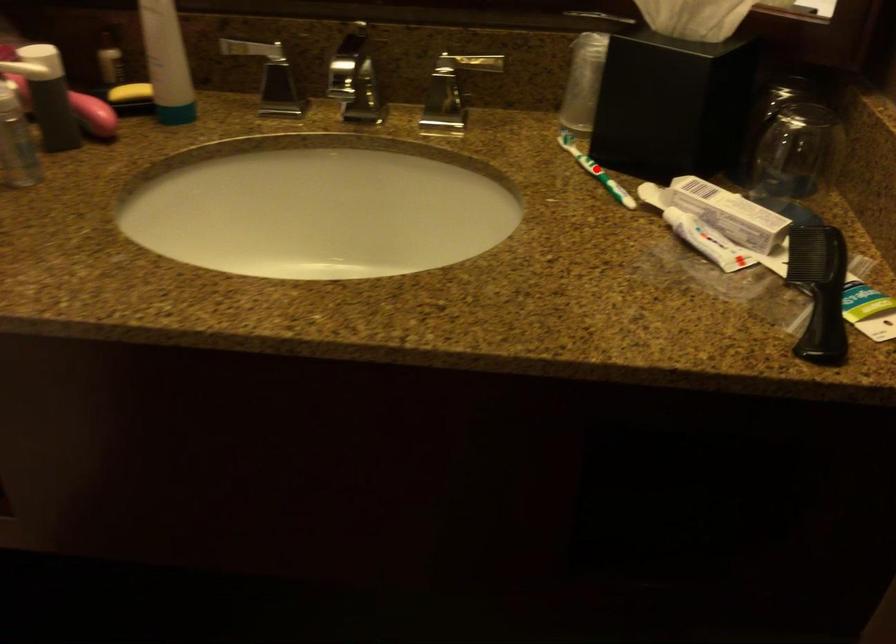
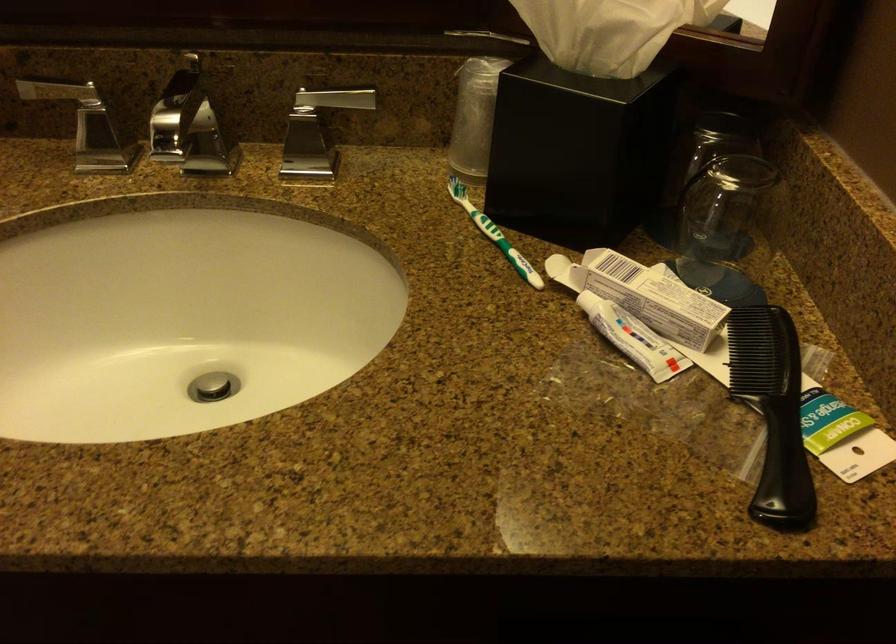
Question: I am providing you with two images of the same scene from different viewpoints. In image1, a red point is highlighted. Considering the same 3D point in image2, which of the following is correct?

Choices:
 (A) It is closer
 (B) It is farther

Answer: (A)